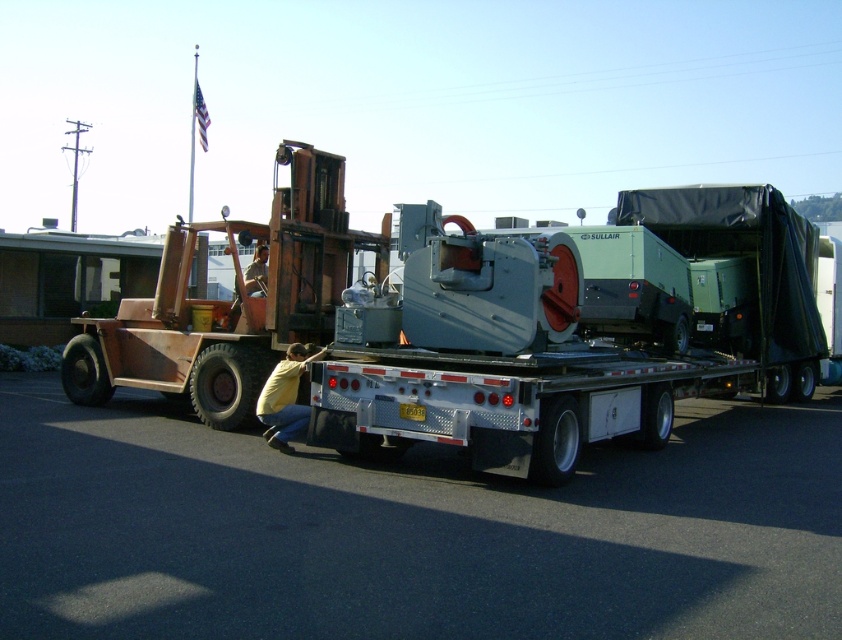
Question: Among these objects, which one is nearest to the camera?

Choices:
 (A) black asphalt at lower center
 (B) metallic gray machinery at center
 (C) rusty metal forklift at center

Answer: (A)

Question: Observing the image, what is the correct spatial positioning of metallic gray machinery at center in reference to yellow shirt at lower center?

Choices:
 (A) above
 (B) below

Answer: (A)

Question: Which point appears farthest from the camera in this image?

Choices:
 (A) (504, 369)
 (B) (297, 420)

Answer: (B)

Question: Is black asphalt at lower center to the left of metallic gray machinery at center from the viewer's perspective?

Choices:
 (A) no
 (B) yes

Answer: (B)

Question: Which object is closer to the camera taking this photo?

Choices:
 (A) rusty metal forklift at center
 (B) yellow shirt at lower center

Answer: (B)

Question: Is black asphalt at lower center smaller than metallic gray machinery at center?

Choices:
 (A) yes
 (B) no

Answer: (A)